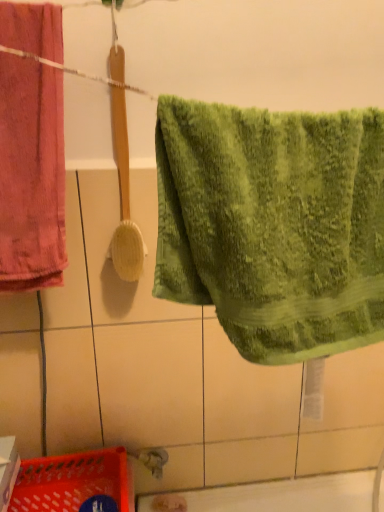
The image size is (384, 512). Identify the location of wooden textured brush at center. (122, 170).

At what (x,y) coordinates should I click in order to perform the action: click on green textured towel at center, placed as the 1th towel when sorted from right to left. Please return your answer as a coordinate pair (x, y). This screenshot has width=384, height=512. Looking at the image, I should click on (273, 225).

The image size is (384, 512). I want to click on translucent plastic basket at lower left, so click(72, 481).

Is the depth of translucent plastic basket at lower left greater than that of green textured towel at center, which is counted as the 2th towel, starting from the back?

Yes, translucent plastic basket at lower left is further from the viewer.

Is translucent plastic basket at lower left positioned far away from green textured towel at center, placed as the 1th towel when sorted from right to left?

They are positioned close to each other.

Who is bigger, translucent plastic basket at lower left or green textured towel at center, which is counted as the 2th towel, starting from the back?

green textured towel at center, which is counted as the 2th towel, starting from the back, is bigger.

From the image's perspective, who appears lower, translucent plastic basket at lower left or green textured towel at center, which is counted as the 2th towel, starting from the back?

translucent plastic basket at lower left.

Does velvety pink towel at left, the 2th towel from the right, have a smaller size compared to wooden textured brush at center?

No.

From a real-world perspective, is velvety pink towel at left, which ranks as the second towel in front-to-back order, located higher than wooden textured brush at center?

Incorrect, from a real-world perspective, velvety pink towel at left, which ranks as the second towel in front-to-back order, is lower than wooden textured brush at center.

Is velvety pink towel at left, acting as the 1th towel starting from the left, inside the boundaries of wooden textured brush at center, or outside?

velvety pink towel at left, acting as the 1th towel starting from the left, is located beyond the bounds of wooden textured brush at center.

Which is more to the right, green textured towel at center, which ranks as the second towel in left-to-right order, or velvety pink towel at left, the 2th towel from the right?

Positioned to the right is green textured towel at center, which ranks as the second towel in left-to-right order.

From a real-world perspective, who is located lower, green textured towel at center, placed as the 1th towel when sorted from right to left, or velvety pink towel at left, the 2th towel from the right?

green textured towel at center, placed as the 1th towel when sorted from right to left.

Are green textured towel at center, which is counted as the 2th towel, starting from the back, and velvety pink towel at left, acting as the 1th towel starting from the left, far apart?

They are positioned close to each other.

Between green textured towel at center, placed as the 1th towel when sorted from right to left, and wooden textured brush at center, which one is positioned in front?

green textured towel at center, placed as the 1th towel when sorted from right to left.

Could you tell me if green textured towel at center, placed as the 1th towel when sorted from right to left, is turned towards wooden textured brush at center?

No, green textured towel at center, placed as the 1th towel when sorted from right to left, is not oriented towards wooden textured brush at center.

Are green textured towel at center, which is counted as the 2th towel, starting from the back, and wooden textured brush at center far apart?

green textured towel at center, which is counted as the 2th towel, starting from the back, is near wooden textured brush at center, not far away.

Starting from the translucent plastic basket at lower left, which towel is the 2nd one in front? Please provide its 2D coordinates.

[(273, 225)]

From a real-world perspective, is green textured towel at center, which is counted as the 2th towel, starting from the back, under translucent plastic basket at lower left?

Actually, green textured towel at center, which is counted as the 2th towel, starting from the back, is physically above translucent plastic basket at lower left in the real world.

Which object is closer to the camera taking this photo, green textured towel at center, placed as the 1th towel when sorted from right to left, or translucent plastic basket at lower left?

green textured towel at center, placed as the 1th towel when sorted from right to left, is in front.

How many degrees apart are the facing directions of green textured towel at center, which appears as the first towel when viewed from the front, and translucent plastic basket at lower left?

0.00564 degrees separate the facing orientations of green textured towel at center, which appears as the first towel when viewed from the front, and translucent plastic basket at lower left.

Find the location of a particular element. This screenshot has height=512, width=384. the 2nd towel positioned above the translucent plastic basket at lower left (from the image's perspective) is located at coordinates (31, 175).

Is point (116, 493) positioned before point (39, 148)?

No.

Based on their sizes in the image, would you say translucent plastic basket at lower left is bigger or smaller than velvety pink towel at left, which ranks as the 1th towel in back-to-front order?

Clearly, translucent plastic basket at lower left is smaller in size than velvety pink towel at left, which ranks as the 1th towel in back-to-front order.

Between wooden textured brush at center and velvety pink towel at left, which ranks as the 1th towel in back-to-front order, which one appears on the left side from the viewer's perspective?

velvety pink towel at left, which ranks as the 1th towel in back-to-front order, is more to the left.

Where is `brush on the right of velvety pink towel at left, which ranks as the 1th towel in back-to-front order`? The image size is (384, 512). brush on the right of velvety pink towel at left, which ranks as the 1th towel in back-to-front order is located at coordinates tap(122, 170).

In terms of size, does wooden textured brush at center appear bigger or smaller than velvety pink towel at left, the 2th towel from the right?

Clearly, wooden textured brush at center is smaller in size than velvety pink towel at left, the 2th towel from the right.

Which towel is the 2nd one when counting from the front of the translucent plastic basket at lower left? Please provide its 2D coordinates.

[(273, 225)]

At what (x,y) coordinates should I click in order to perform the action: click on brush that appears above the velvety pink towel at left, which ranks as the 1th towel in back-to-front order (from a real-world perspective). Please return your answer as a coordinate pair (x, y). Image resolution: width=384 pixels, height=512 pixels. Looking at the image, I should click on (122, 170).

Looking at the image, which one is located further to green textured towel at center, which is counted as the 2th towel, starting from the back, velvety pink towel at left, the 2th towel from the right, or translucent plastic basket at lower left?

translucent plastic basket at lower left is positioned further to the anchor green textured towel at center, which is counted as the 2th towel, starting from the back.

Estimate the real-world distances between objects in this image. Which object is further from green textured towel at center, which ranks as the second towel in left-to-right order, translucent plastic basket at lower left or velvety pink towel at left, which ranks as the second towel in front-to-back order?

translucent plastic basket at lower left.

Which object lies nearer to the anchor point velvety pink towel at left, the 2th towel from the right, translucent plastic basket at lower left or green textured towel at center, which ranks as the second towel in left-to-right order?

green textured towel at center, which ranks as the second towel in left-to-right order.

When comparing their distances from velvety pink towel at left, acting as the 1th towel starting from the left, does wooden textured brush at center or green textured towel at center, which ranks as the second towel in left-to-right order, seem further?

green textured towel at center, which ranks as the second towel in left-to-right order.

Considering their positions, is translucent plastic basket at lower left positioned further to wooden textured brush at center than velvety pink towel at left, the 2th towel from the right?

Among the two, translucent plastic basket at lower left is located further to wooden textured brush at center.

When comparing their distances from translucent plastic basket at lower left, does wooden textured brush at center or velvety pink towel at left, which ranks as the second towel in front-to-back order, seem further?

The object further to translucent plastic basket at lower left is velvety pink towel at left, which ranks as the second towel in front-to-back order.

Looking at the image, which one is located further to velvety pink towel at left, which ranks as the second towel in front-to-back order, green textured towel at center, which ranks as the second towel in left-to-right order, or wooden textured brush at center?

green textured towel at center, which ranks as the second towel in left-to-right order, is further to velvety pink towel at left, which ranks as the second towel in front-to-back order.

Considering their positions, is wooden textured brush at center positioned closer to green textured towel at center, which is counted as the 2th towel, starting from the back, than translucent plastic basket at lower left?

wooden textured brush at center is positioned closer to the anchor green textured towel at center, which is counted as the 2th towel, starting from the back.

Image resolution: width=384 pixels, height=512 pixels. I want to click on towel between velvety pink towel at left, the 2th towel from the right, and translucent plastic basket at lower left in the up-down direction, so click(x=273, y=225).

Find the location of a particular element. brush located between velvety pink towel at left, which ranks as the 1th towel in back-to-front order, and green textured towel at center, which is counted as the 2th towel, starting from the back, in the left-right direction is located at coordinates (122, 170).